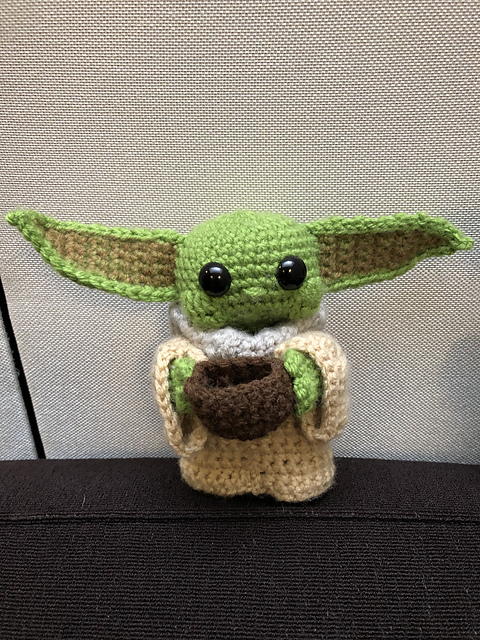
Where is `coat`? This screenshot has width=480, height=640. coat is located at coordinates (241, 454), (163, 353), (330, 349).